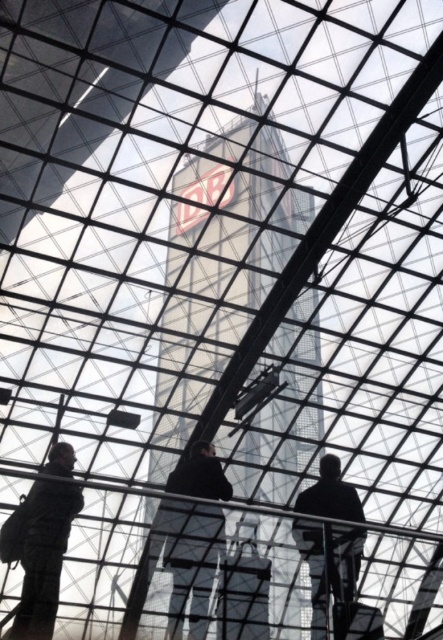
You are standing under the glass ceiling structure and see two figures. The silhouette figure at lower left and the dark clothing figure at center. Which figure appears shorter in the image?

The silhouette figure at lower left appears shorter than the dark clothing figure at center because it is not as tall as the dark clothing figure at center.

You are standing at the lower right of the image and want to see the transparent glass tower at center. Is the black matte person at lower right blocking your view of it?

The transparent glass tower at center is in front of the black matte person at lower right, so the person is blocking your view of it.